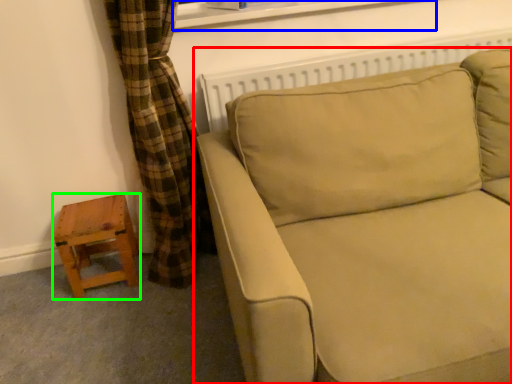
Question: Considering the real-world distances, which object is farthest from studio couch (highlighted by a red box)? window frame (highlighted by a blue box) or stool (highlighted by a green box)?

Choices:
 (A) window frame
 (B) stool

Answer: (B)